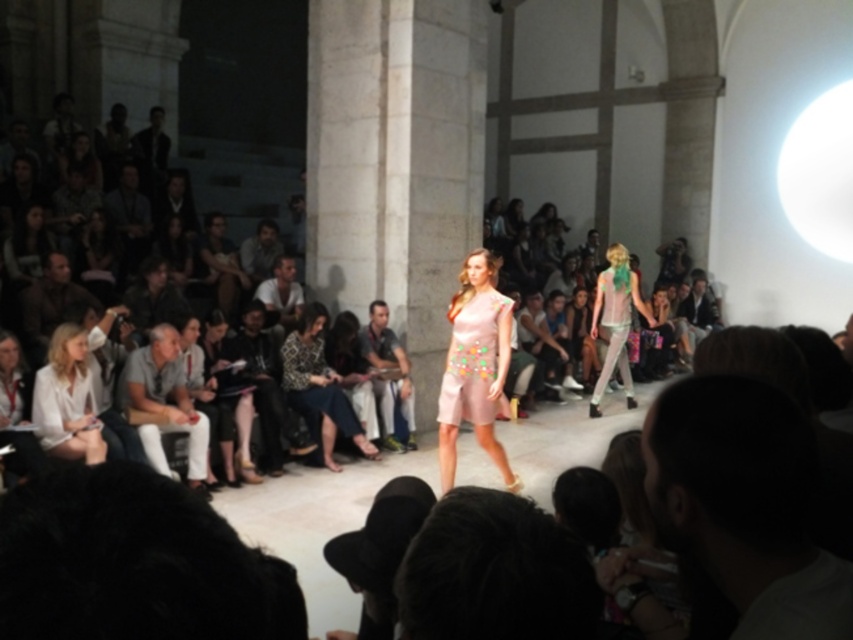
Question: Where is gray cotton pants at left located in relation to pale pink satin dress at center in the image?

Choices:
 (A) right
 (B) left

Answer: (B)

Question: Considering the real-world distances, which object is closest to the gray fabric jacket at upper center?

Choices:
 (A) gray cotton pants at left
 (B) patterned fabric dress at center
 (C) matte white blouse at lower left
 (D) pink satin dress at center

Answer: (B)

Question: Is gray cotton pants at left closer to the viewer compared to gray fabric jacket at upper center?

Choices:
 (A) yes
 (B) no

Answer: (A)

Question: Estimate the real-world distances between objects in this image. Which object is farther from the pink satin dress at center?

Choices:
 (A) light brown leather jacket at upper center
 (B) gray cotton pants at left
 (C) denim jeans at center
 (D) white matte jacket at lower left

Answer: (A)

Question: Is pastel pink fabric dress at center to the right of denim jeans at center from the viewer's perspective?

Choices:
 (A) yes
 (B) no

Answer: (A)

Question: Which of these objects is positioned farthest from the white cotton shirt at center?

Choices:
 (A) patterned fabric dress at center
 (B) pastel pink fabric dress at center
 (C) denim jeans at center

Answer: (B)